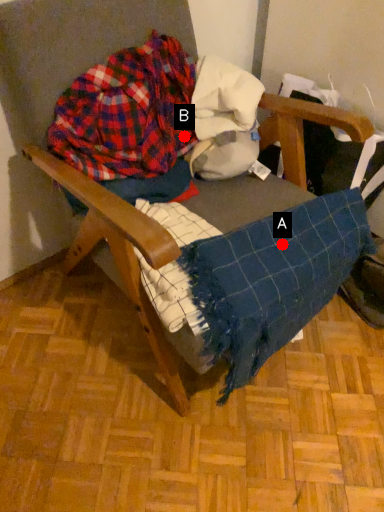
Question: Two points are circled on the image, labeled by A and B beside each circle. Which point is farther to the camera?

Choices:
 (A) A is further
 (B) B is further

Answer: (B)